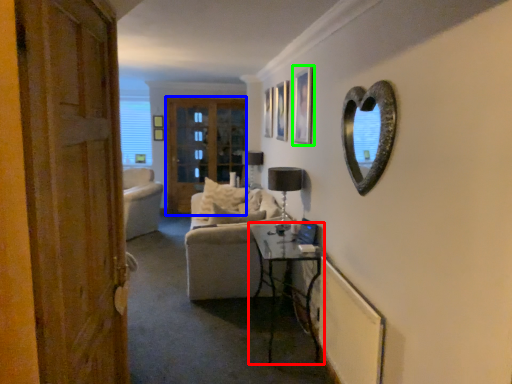
Question: Which is farther away from table (highlighted by a red box)? screen door (highlighted by a blue box) or picture frame (highlighted by a green box)?

Choices:
 (A) screen door
 (B) picture frame

Answer: (A)